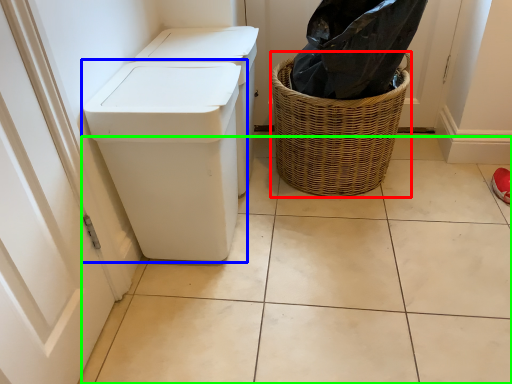
Question: Which object is positioned closest to basket (highlighted by a red box)? Select from waste container (highlighted by a blue box) and tile (highlighted by a green box).

Choices:
 (A) waste container
 (B) tile

Answer: (B)